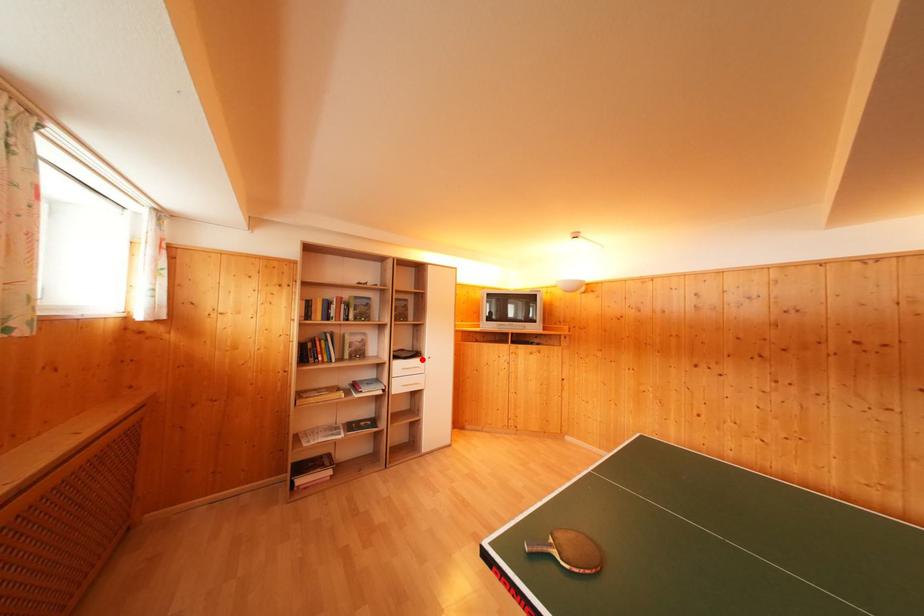
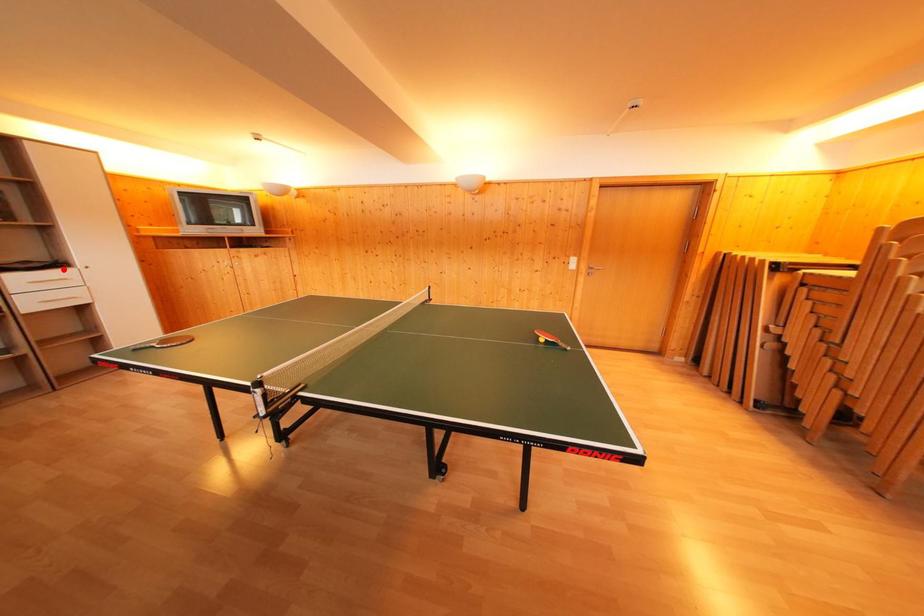
I am providing you with two images of the same scene from different viewpoints. A red point is marked on the first image and another point is marked on the second image. Is the marked point in image1 the same physical position as the marked point in image2?

Yes